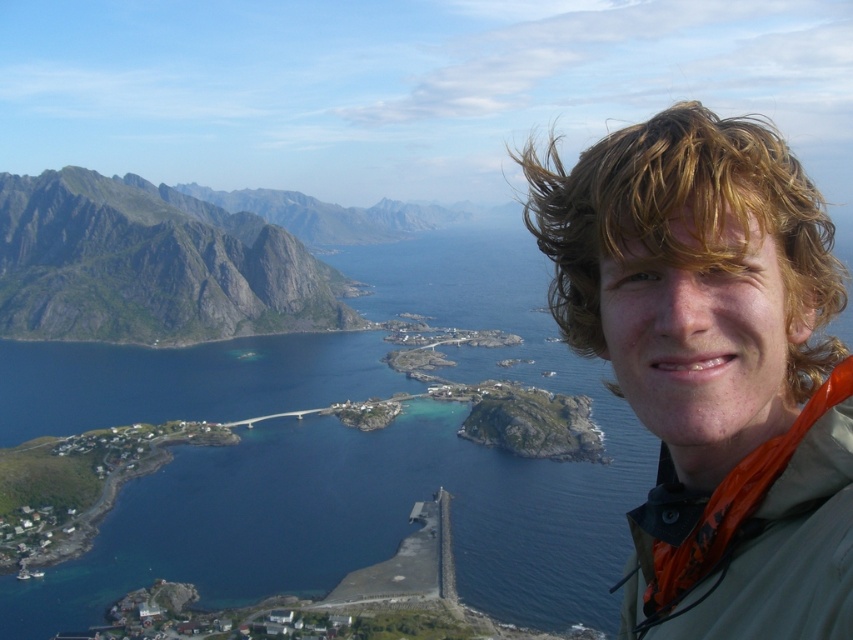
Question: Based on their relative distances, which object is farther from the blonde curly hair at upper right?

Choices:
 (A) blue water at center
 (B) gray rocky mountain at left

Answer: (B)

Question: Is the position of blue water at center more distant than that of blonde curly hair at upper right?

Choices:
 (A) yes
 (B) no

Answer: (A)

Question: Can you confirm if gray rocky mountain at left is positioned below blonde curly hair at upper right?

Choices:
 (A) yes
 (B) no

Answer: (B)

Question: Which object appears closest to the camera in this image?

Choices:
 (A) blue water at center
 (B) gray rocky mountain at left

Answer: (A)

Question: From the image, what is the correct spatial relationship of gray rocky mountain at left in relation to blonde curly hair at upper right?

Choices:
 (A) above
 (B) below

Answer: (A)

Question: Among these objects, which one is nearest to the camera?

Choices:
 (A) blue water at center
 (B) gray rocky mountain at left
 (C) blonde curly hair at upper right

Answer: (C)